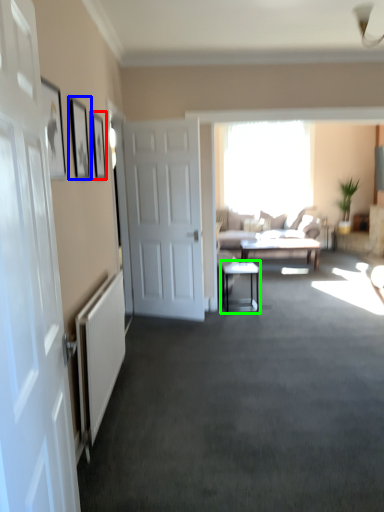
Question: Based on their relative distances, which object is farther from picture frame (highlighted by a red box)? Choose from picture frame (highlighted by a blue box) and table (highlighted by a green box).

Choices:
 (A) picture frame
 (B) table

Answer: (B)